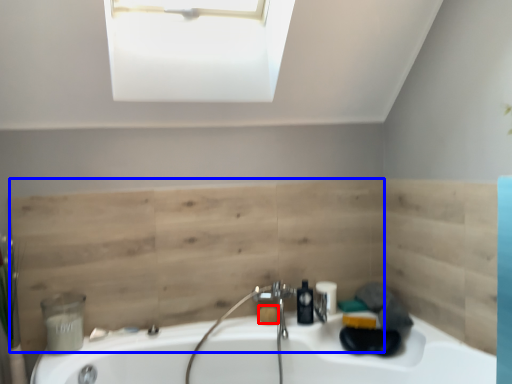
Question: Which point is closer to the camera, soap (highlighted by a red box) or plywood (highlighted by a blue box)?

Choices:
 (A) soap
 (B) plywood

Answer: (B)